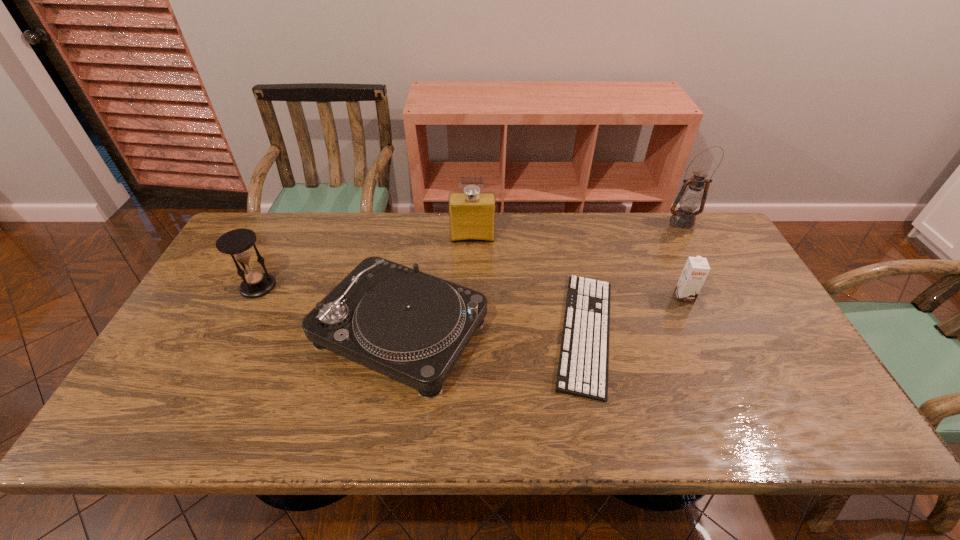
Where is `vacant space located on the left of the tallest object`? The height and width of the screenshot is (540, 960). vacant space located on the left of the tallest object is located at coordinates (637, 222).

Image resolution: width=960 pixels, height=540 pixels. Identify the location of vacant space situated 0.310m on the front-facing side of the fifth shortest object. (471, 316).

Where is `free space located 0.250m on the right of the leftmost object`? free space located 0.250m on the right of the leftmost object is located at coordinates (361, 286).

Identify the location of free space located on the front of the fifth object from left to right. This screenshot has height=540, width=960. (714, 362).

Find the location of a particular element. free space located on the back of the record player is located at coordinates (412, 266).

This screenshot has height=540, width=960. Find the location of `free spot located on the left of the shortest object`. free spot located on the left of the shortest object is located at coordinates (483, 333).

This screenshot has width=960, height=540. Find the location of `oil lamp present at the far edge`. oil lamp present at the far edge is located at coordinates (690, 198).

Identify the location of perfume present at the far edge. (472, 214).

What are the coordinates of `object present at the left edge` in the screenshot? It's located at (238, 243).

The image size is (960, 540). In order to click on object at the right edge in this screenshot , I will do `click(690, 198)`.